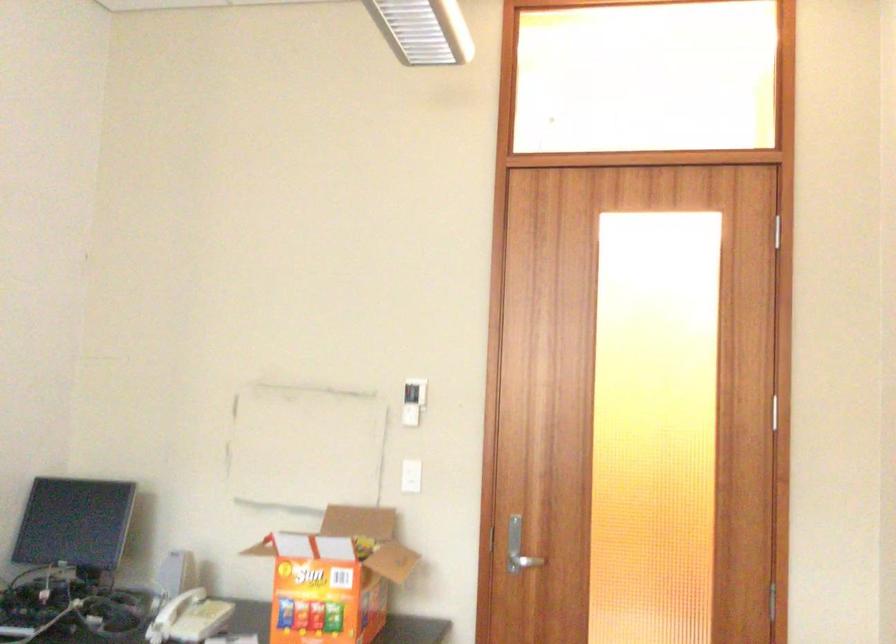
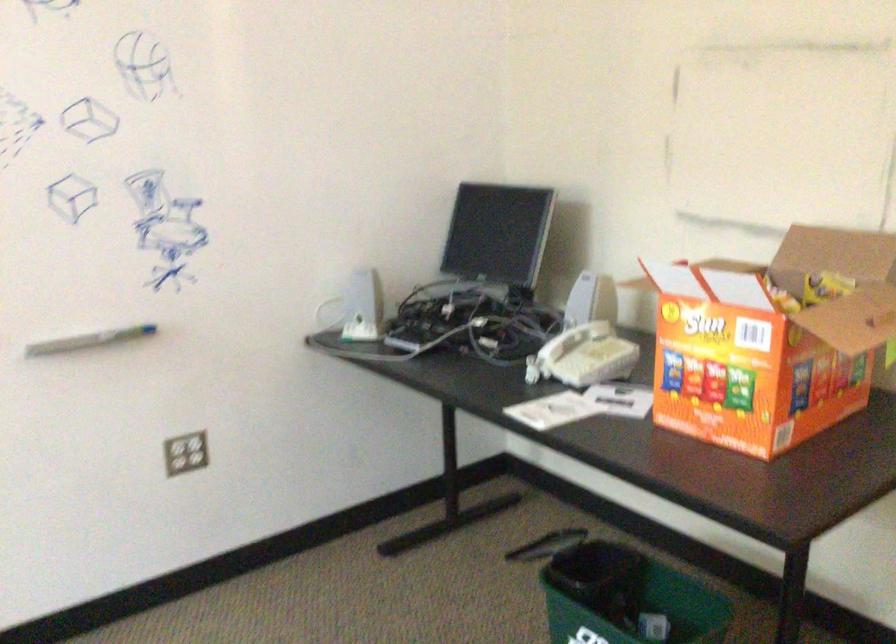
Find the pixel in the second image that matches pixel 174 573 in the first image.

(579, 305)